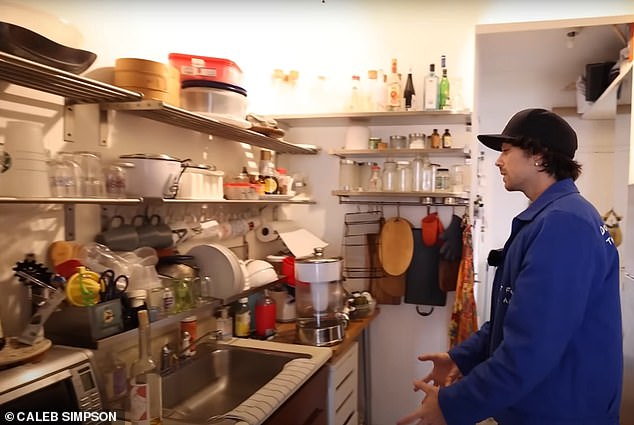
I want to click on bottles, so click(392, 91), click(446, 97), click(430, 91), click(410, 88), click(370, 97), click(353, 97).